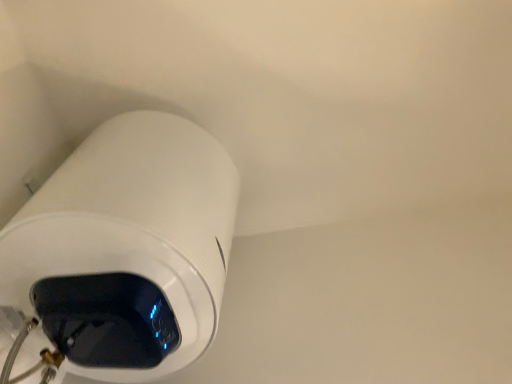
At what (x,y) coordinates should I click in order to perform the action: click on white glossy toilet paper at upper left. Please return your answer as a coordinate pair (x, y). This screenshot has height=384, width=512. Looking at the image, I should click on (123, 252).

Measure the distance between white glossy toilet paper at upper left and camera.

The depth of white glossy toilet paper at upper left is 27.13 inches.

What is the approximate width of white glossy toilet paper at upper left?

18.72 inches.

What do you see at coordinates (123, 252) in the screenshot? This screenshot has width=512, height=384. I see `white glossy toilet paper at upper left` at bounding box center [123, 252].

At what (x,y) coordinates should I click in order to perform the action: click on white glossy toilet paper at upper left. Please return your answer as a coordinate pair (x, y). Looking at the image, I should click on point(123,252).